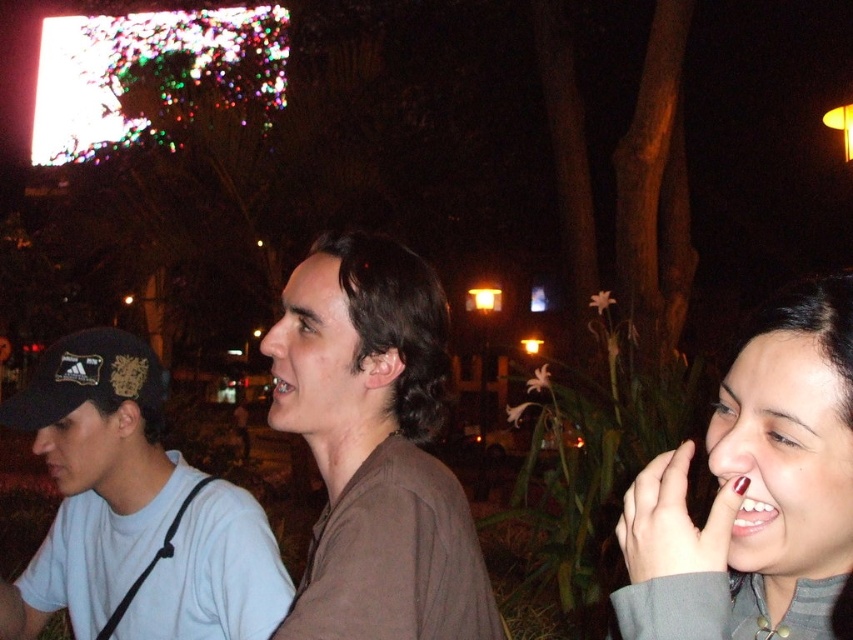
Can you confirm if matte gray sweater at right is taller than black fabric baseball cap at left?

Correct, matte gray sweater at right is much taller as black fabric baseball cap at left.

Is point (821, 300) less distant than point (160, 390)?

Yes.

The height and width of the screenshot is (640, 853). I want to click on matte gray sweater at right, so click(756, 493).

Is matte gray sweater at right to the right of white matte shirt at left from the viewer's perspective?

Yes, matte gray sweater at right is to the right of white matte shirt at left.

Does matte gray sweater at right have a larger size compared to white matte shirt at left?

No, matte gray sweater at right is not bigger than white matte shirt at left.

What do you see at coordinates (756, 493) in the screenshot? I see `matte gray sweater at right` at bounding box center [756, 493].

Find the location of `matte gray sweater at right`. matte gray sweater at right is located at coordinates (756, 493).

Which of these two, white matte shirt at left or black fabric baseball cap at left, stands shorter?

black fabric baseball cap at left

Does white matte shirt at left have a greater width compared to black fabric baseball cap at left?

Yes, white matte shirt at left is wider than black fabric baseball cap at left.

Is point (161, 548) positioned behind point (138, 381)?

That is False.

The height and width of the screenshot is (640, 853). Find the location of `white matte shirt at left`. white matte shirt at left is located at coordinates (132, 512).